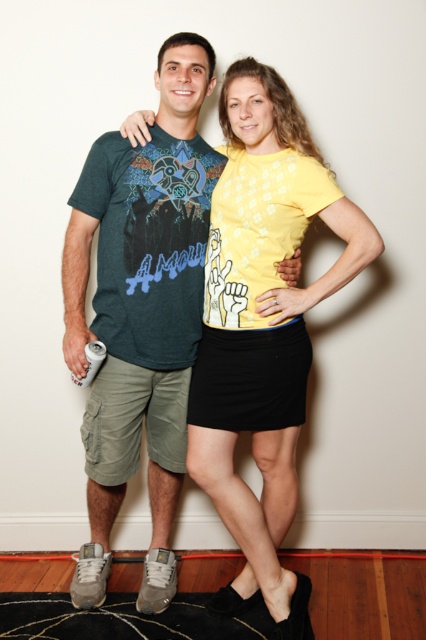
Is matte green t-shirt at center behind black textured rug at lower center?

Yes, it is behind black textured rug at lower center.

The width and height of the screenshot is (426, 640). I want to click on matte green t-shirt at center, so click(141, 310).

Is yellow matte t-shirt at center behind black textured rug at lower center?

No, yellow matte t-shirt at center is in front of black textured rug at lower center.

Does point (288, 230) come farther from viewer compared to point (249, 611)?

No, (288, 230) is in front of (249, 611).

Is point (267, 109) more distant than point (207, 636)?

No, (267, 109) is closer to viewer.

Locate an element on the screen. This screenshot has width=426, height=640. yellow matte t-shirt at center is located at coordinates (261, 317).

Is matte green t-shirt at center positioned in front of yellow matte t-shirt at center?

No, it is behind yellow matte t-shirt at center.

Can you confirm if matte green t-shirt at center is positioned above yellow matte t-shirt at center?

Yes, matte green t-shirt at center is above yellow matte t-shirt at center.

Who is more forward, [97,316] or [233,125]?

Point [233,125] is more forward.

The width and height of the screenshot is (426, 640). In order to click on matte green t-shirt at center in this screenshot , I will do `click(141, 310)`.